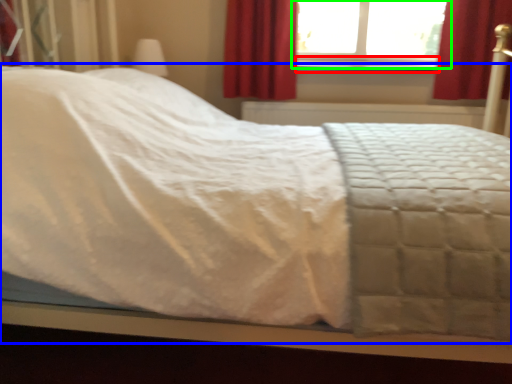
Question: Which object is the closest to the window sill (highlighted by a red box)? Choose among these: bed (highlighted by a blue box) or window (highlighted by a green box).

Choices:
 (A) bed
 (B) window

Answer: (B)